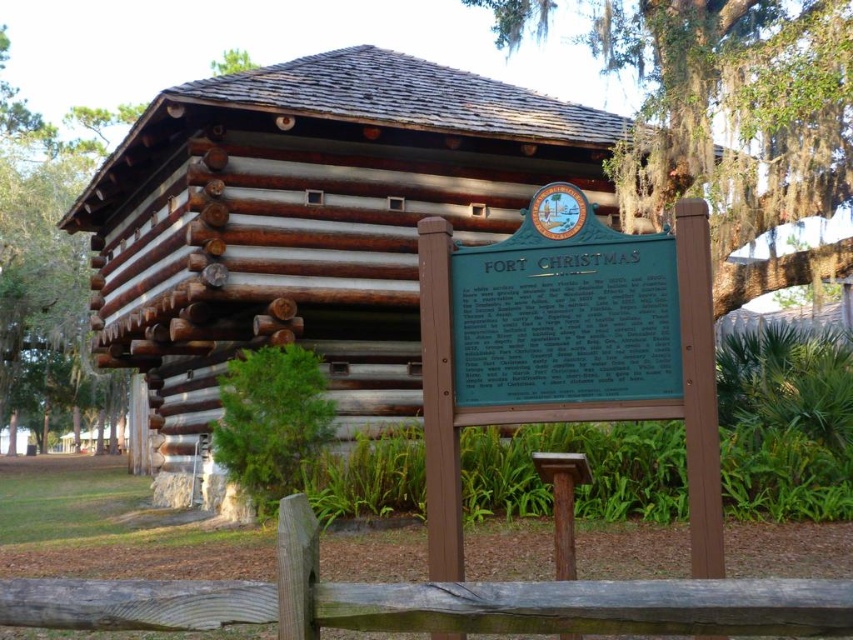
Which is more to the left, green mossy tree at upper right or green leafy tree at left?

Positioned to the left is green leafy tree at left.

Which is in front, point (758, 33) or point (16, 209)?

Point (758, 33)

Between point (802, 208) and point (44, 132), which one is positioned in front?

Point (802, 208)

Image resolution: width=853 pixels, height=640 pixels. Find the location of `green mossy tree at upper right`. green mossy tree at upper right is located at coordinates (740, 122).

Can you confirm if green plaque at center is positioned above green mossy tree at upper right?

No.

Does green plaque at center appear on the right side of green mossy tree at upper right?

Incorrect, green plaque at center is not on the right side of green mossy tree at upper right.

Which is in front, point (618, 237) or point (825, 20)?

Positioned in front is point (618, 237).

Locate an element on the screen. This screenshot has width=853, height=640. green plaque at center is located at coordinates (567, 346).

Who is shorter, wooden log cabin at center or green leafy tree at left?

wooden log cabin at center is shorter.

Consider the image. Who is positioned more to the left, wooden log cabin at center or green leafy tree at left?

Positioned to the left is green leafy tree at left.

Which is behind, point (380, 209) or point (107, 376)?

Point (107, 376)

Identify the location of wooden log cabin at center. (309, 221).